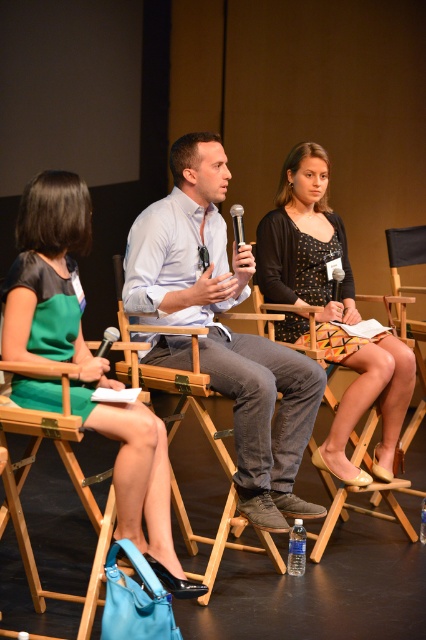
Between light blue shirt at center and black plastic microphone at center, which one is positioned higher?

black plastic microphone at center is higher up.

Can you confirm if light blue shirt at center is positioned above black plastic microphone at center?

No.

Locate an element on the screen. light blue shirt at center is located at coordinates (224, 330).

Who is lower down, polka dot dress at center or matte black microphone at center?

matte black microphone at center is below.

Consider the image. Which is more to the left, polka dot dress at center or matte black microphone at center?

Positioned to the left is matte black microphone at center.

The image size is (426, 640). Identify the location of polka dot dress at center. (331, 308).

At what (x,y) coordinates should I click in order to perform the action: click on polka dot dress at center. Please return your answer as a coordinate pair (x, y). The width and height of the screenshot is (426, 640). Looking at the image, I should click on (331, 308).

Can you confirm if polka dot dress at center is positioned below black plastic microphone at center?

Indeed, polka dot dress at center is positioned under black plastic microphone at center.

Is polka dot dress at center taller than black plastic microphone at center?

Yes.

Does point (374, 353) come behind point (336, 300)?

No, (374, 353) is closer to viewer.

You are a GUI agent. You are given a task and a screenshot of the screen. Output one action in this format:
    pyautogui.click(x=<x>, y=<y>)
    Task: Click on the polka dot dress at center
    
    Given the screenshot: What is the action you would take?
    pyautogui.click(x=331, y=308)